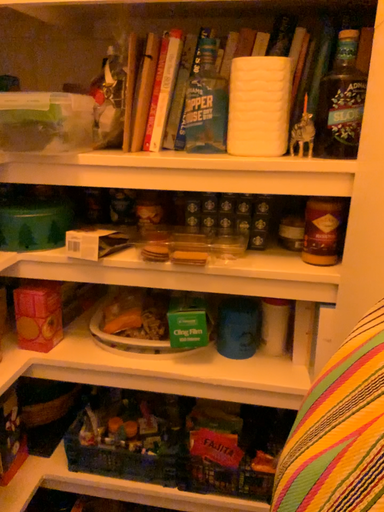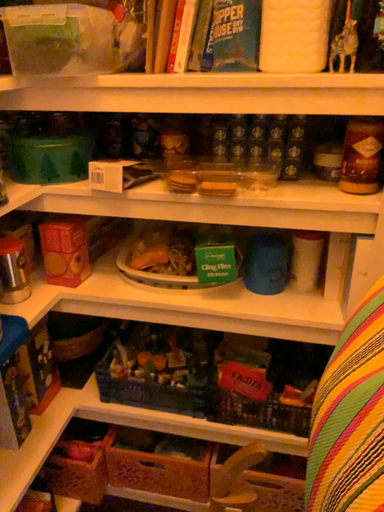
Question: How did the camera likely rotate when shooting the video?

Choices:
 (A) rotated downward
 (B) rotated upward

Answer: (A)